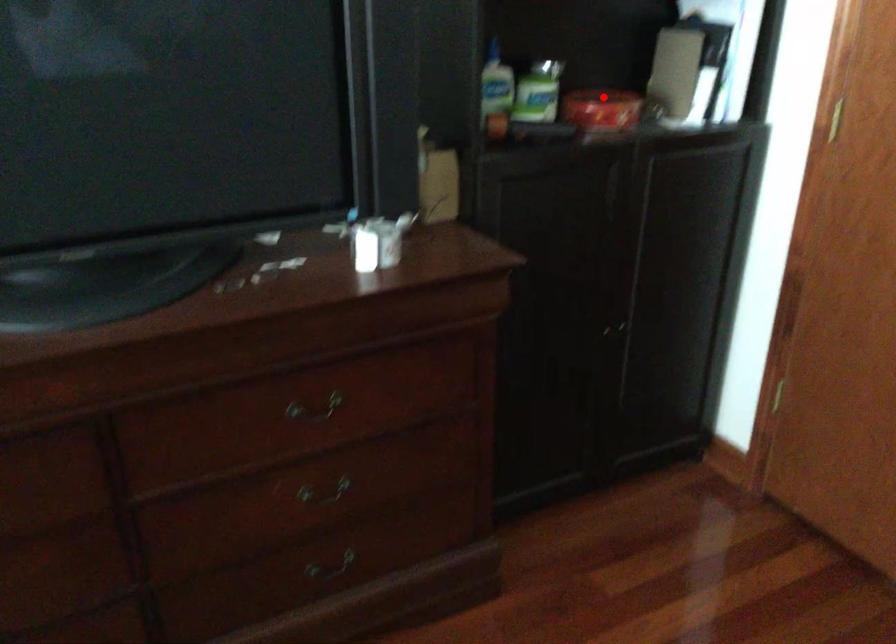
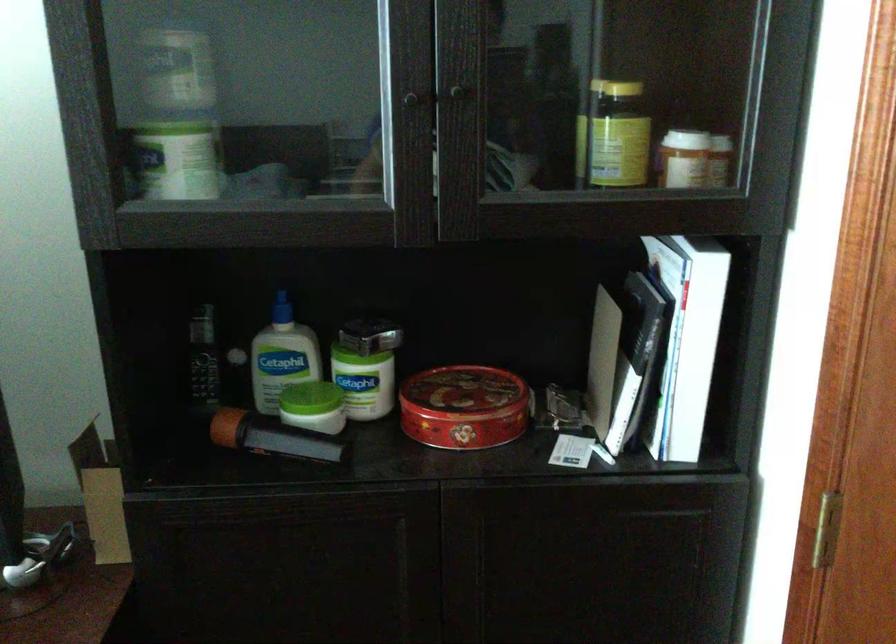
Question: A red point is marked in image1. In image2, is the corresponding 3D point closer to the camera or farther? Reply with the corresponding letter.

Choices:
 (A) The corresponding 3D point is closer.
 (B) The corresponding 3D point is farther.

Answer: (A)